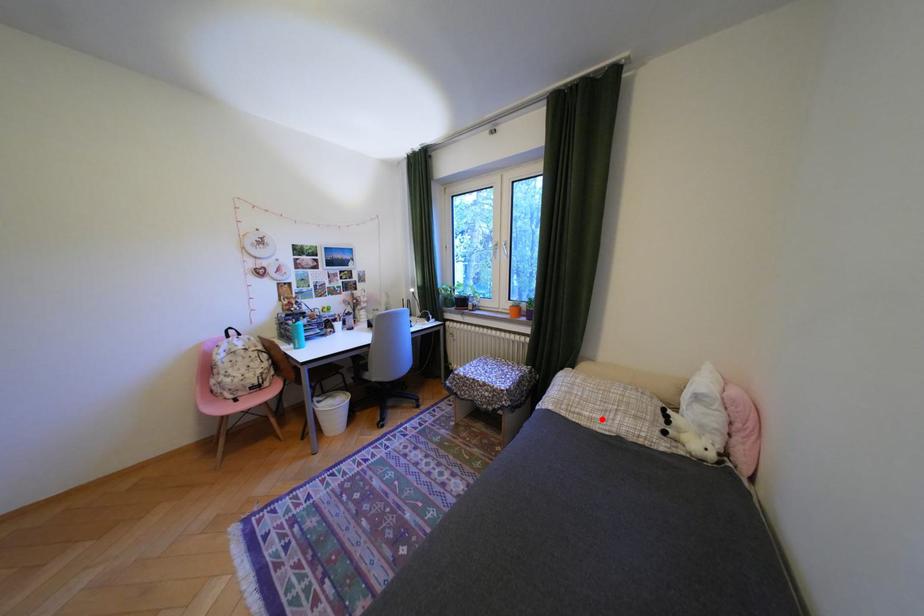
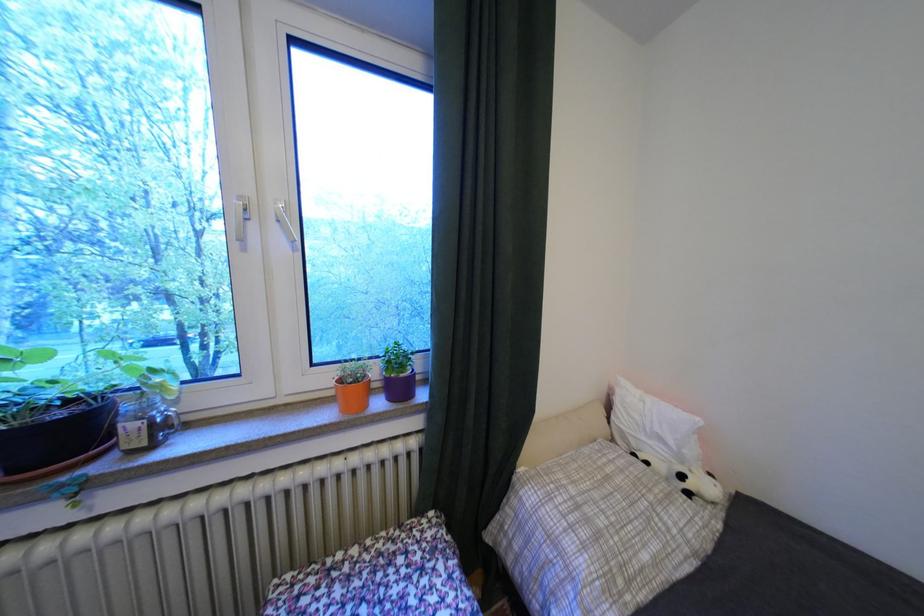
Question: I am providing you with two images of the same scene from different viewpoints. A red point is shown in image1. For the corresponding object point in image2, is it positioned nearer or farther from the camera?

Choices:
 (A) Nearer
 (B) Farther

Answer: (A)